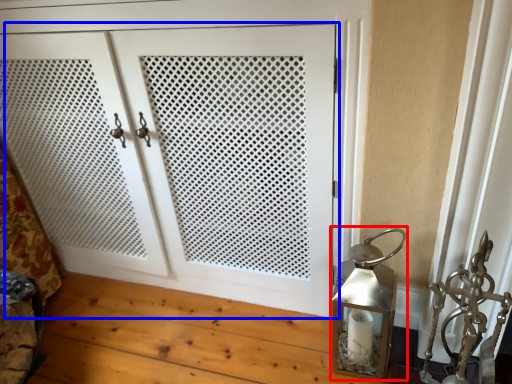
Question: Which point is further to the camera, table lamp (highlighted by a red box) or door (highlighted by a blue box)?

Choices:
 (A) table lamp
 (B) door

Answer: (A)